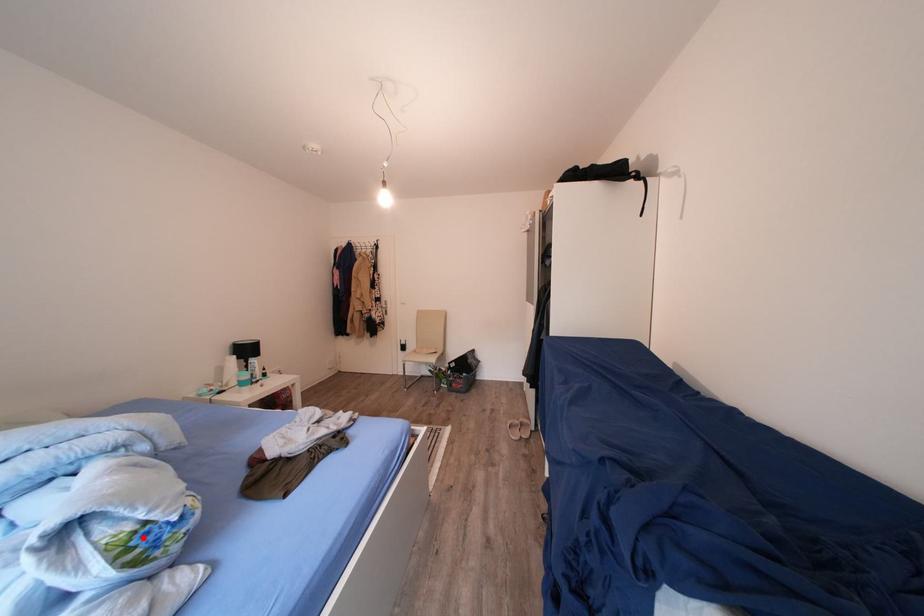
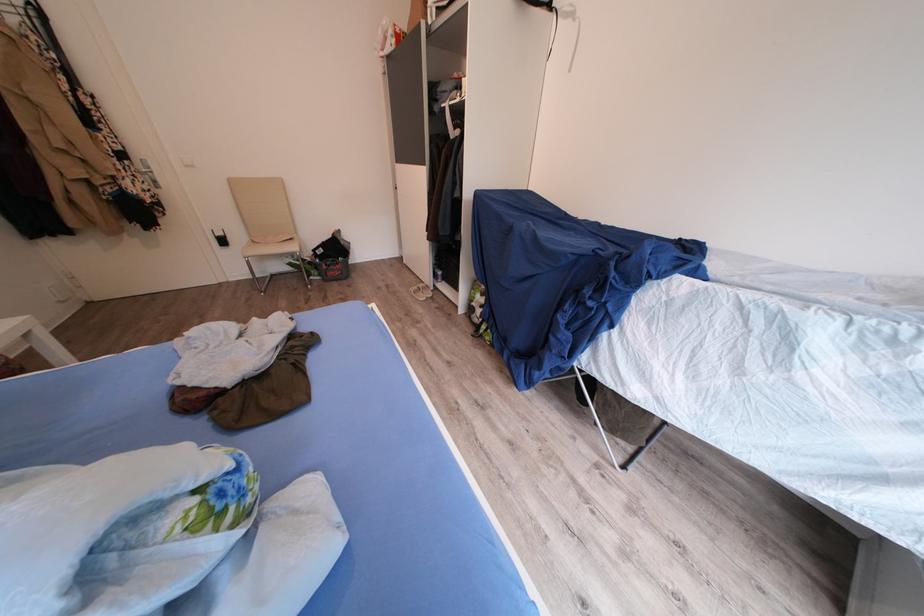
Locate, in the second image, the point that corresponds to the highlighted location in the first image.

(213, 507)